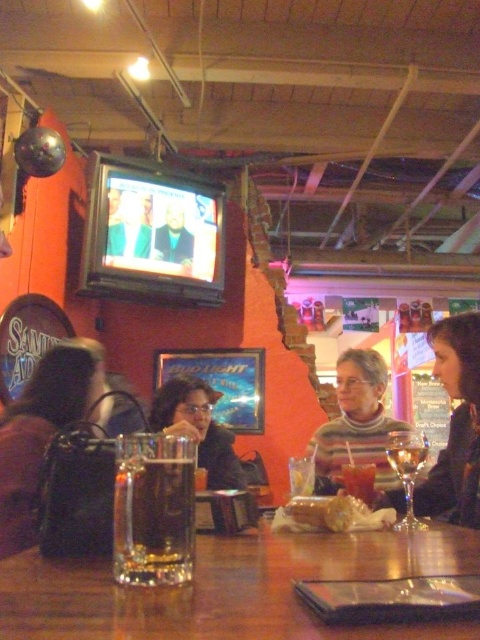
Question: Does clear glass wine glass at lower right appear on the left side of smooth black jacket at upper center?

Choices:
 (A) yes
 (B) no

Answer: (B)

Question: Is translucent plastic bag at center to the left of translucent glass wine at center from the viewer's perspective?

Choices:
 (A) no
 (B) yes

Answer: (B)

Question: Which of the following is the farthest from the observer?

Choices:
 (A) smooth black jacket at upper center
 (B) translucent glass drink at center
 (C) striped sweater at center
 (D) matte black hair at center

Answer: (A)

Question: Which object is positioned farthest from the clear glass wine glass at lower right?

Choices:
 (A) matte black purse at left
 (B) striped sweater at center
 (C) translucent glass beer at center
 (D) smooth black jacket at upper center

Answer: (D)

Question: Is translucent glass mug at center closer to the viewer compared to clear glass wine glass at lower right?

Choices:
 (A) yes
 (B) no

Answer: (A)

Question: Which point is farther to the camera?

Choices:
 (A) matte black hair at center
 (B) translucent glass drink at center
 (C) smooth black jacket at upper center

Answer: (C)